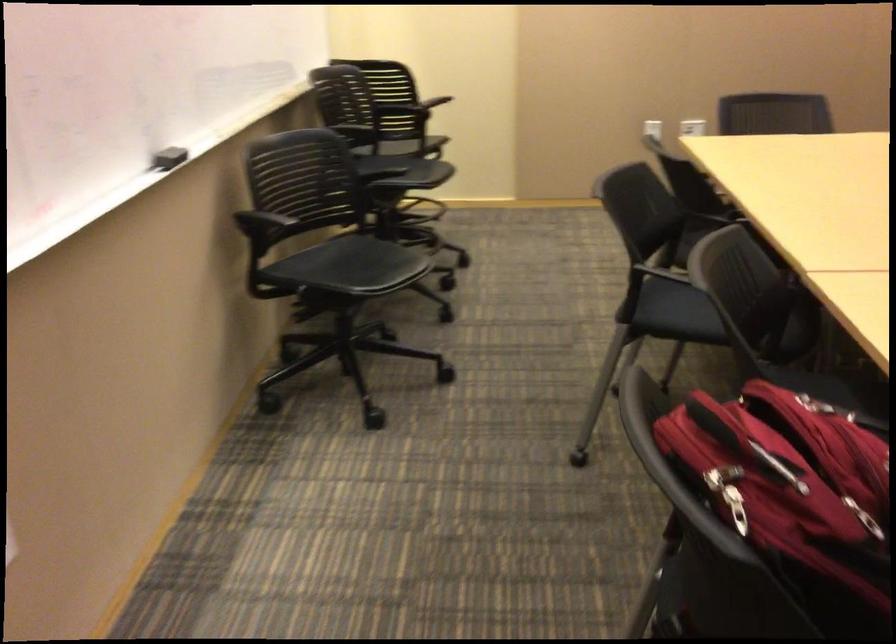
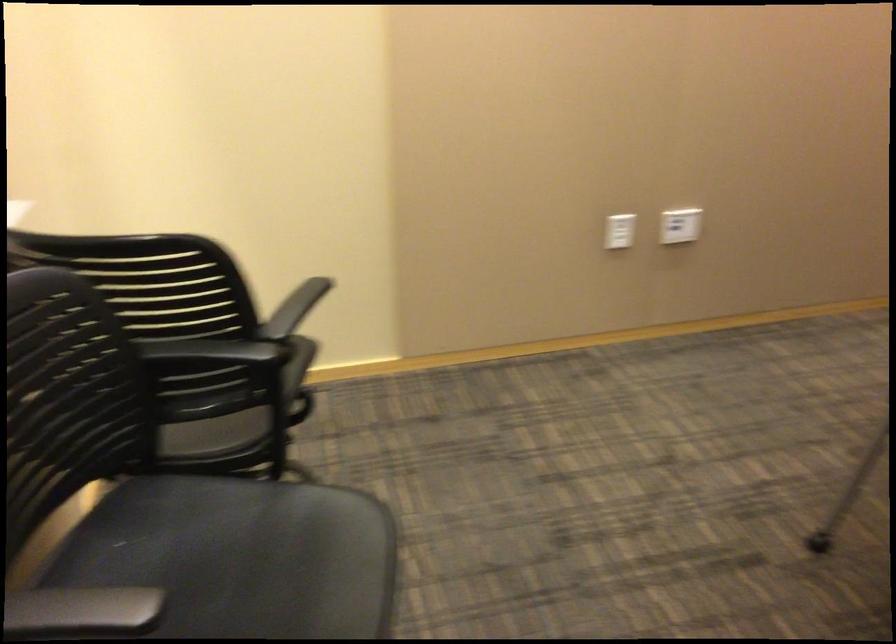
Question: The images are taken continuously from a first-person perspective. In which direction are you moving?

Choices:
 (A) Left
 (B) Right
 (C) Forward
 (D) Backward

Answer: (C)